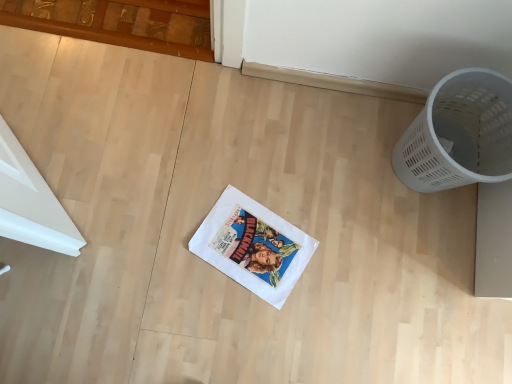
At what (x,y) coordinates should I click in order to perform the action: click on vacant space positioned to the left of white plastic basket at right. Please return your answer as a coordinate pair (x, y). Image resolution: width=512 pixels, height=384 pixels. Looking at the image, I should click on (339, 148).